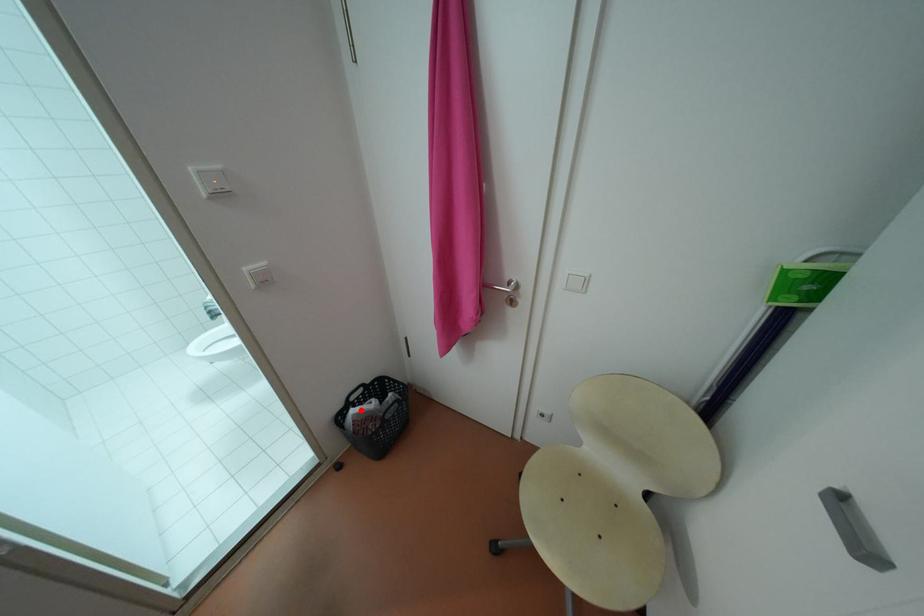
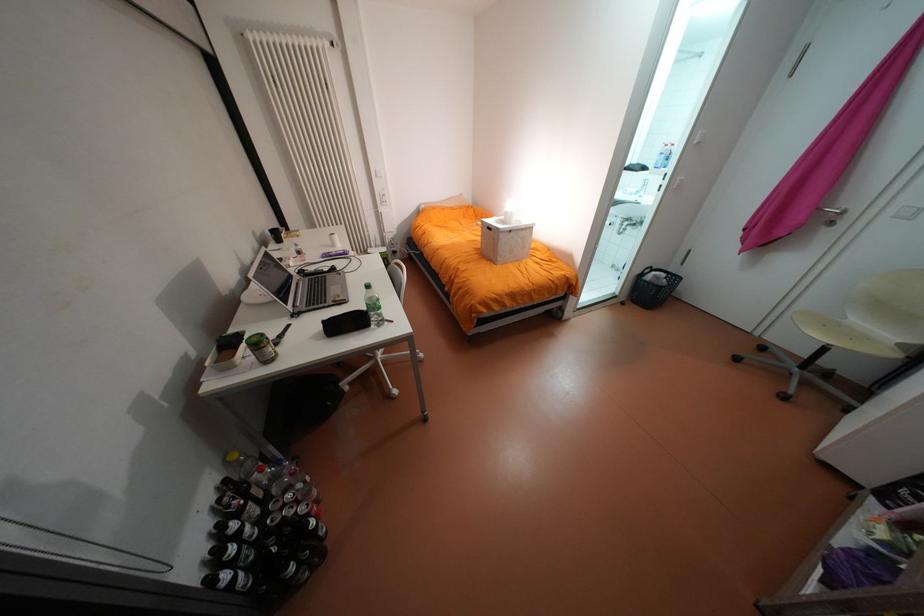
The point at the highlighted location is marked in the first image. Where is the corresponding point in the second image?

(663, 273)